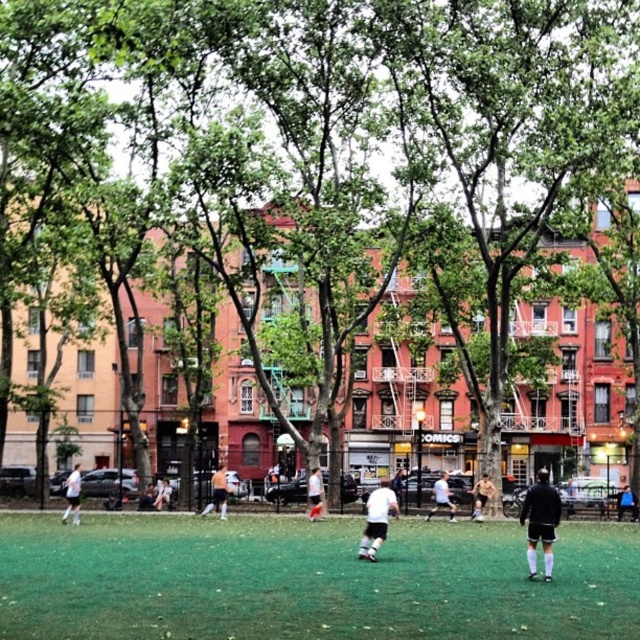
You are a photographer positioned at the edge of the soccer field. You want to take a photo of both the white jersey at center and the white matte shirt at center. Which one will appear larger in your photo?

The white jersey at center will appear larger in the photo because it is closer to the viewer than the white matte shirt at center.

You are a photographer standing at the edge of the soccer field. You want to take a photo that includes both the white jersey at center and the white matte shirt at center. If your camera has a maximum focus range of 20 meters, will you be able to capture both subjects clearly in the same frame?

The white jersey at center and white matte shirt at center are 21.39 meters apart from each other. Since the distance between them exceeds the camera maximum focus range of 20 meters, you won not be able to capture both subjects clearly in the same frame.